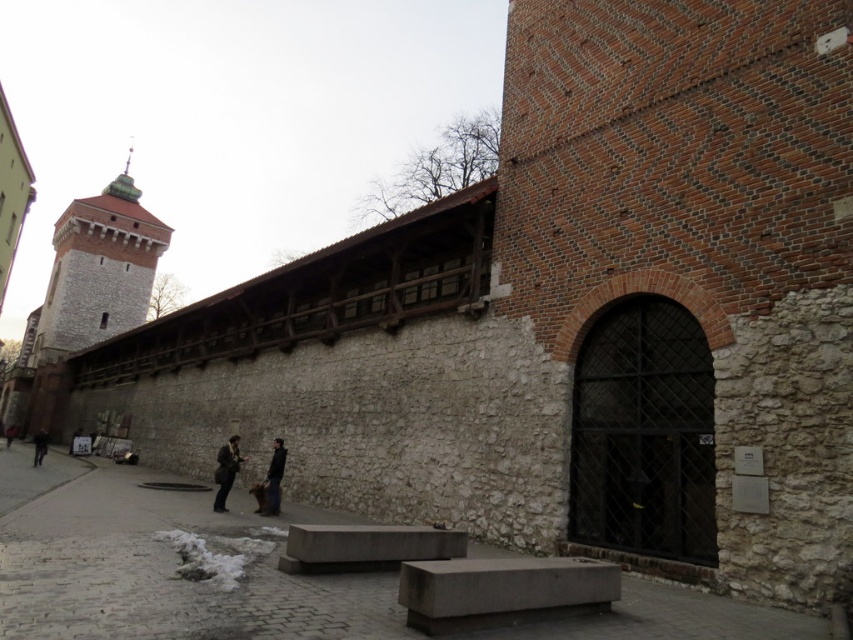
Between gray stone tower at upper left and dark brown leather jacket at lower center, which one appears on the left side from the viewer's perspective?

gray stone tower at upper left is more to the left.

This screenshot has height=640, width=853. Identify the location of gray stone tower at upper left. (97, 269).

How much distance is there between gray concrete bench at center and gray stone tower at upper left?

117.11 meters

Who is more forward, (734, 608) or (88, 218)?

Positioned in front is point (734, 608).

What do you see at coordinates (163, 564) in the screenshot? I see `gray concrete bench at center` at bounding box center [163, 564].

Identify the location of gray concrete bench at center. (163, 564).

Is black leather jacket at center behind dark brown leather jacket at lower center?

That is False.

Does black leather jacket at center have a greater height compared to dark brown leather jacket at lower center?

No.

Locate an element on the screen. The width and height of the screenshot is (853, 640). black leather jacket at center is located at coordinates (271, 481).

You are a GUI agent. You are given a task and a screenshot of the screen. Output one action in this format:
    pyautogui.click(x=<x>, y=<y>)
    Task: Click on the black leather jacket at center
    Image resolution: width=853 pixels, height=640 pixels.
    Given the screenshot: What is the action you would take?
    pyautogui.click(x=271, y=481)